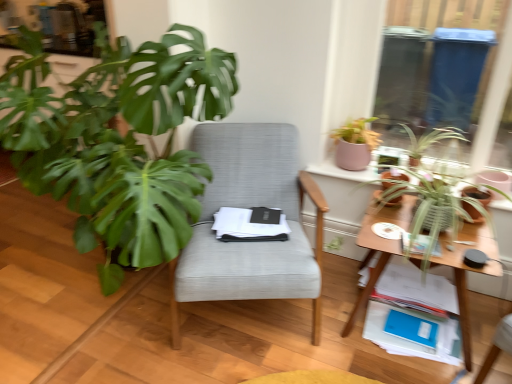
Locate an element on the screen. pink matte pot at upper right, positioned as the 2th houseplant in left-to-right order is located at coordinates (355, 144).

Measure the distance between leavesy green plant at right, the third houseplant viewed from the right, and camera.

They are 1.54 meters apart.

In order to face leavesy green plant at right, the third houseplant viewed from the right, should I rotate leftwards or rightwards?

To face it directly, rotate right by 20.957 degrees.

Locate an element on the screen. wooden table at right is located at coordinates (465, 272).

Locate an element on the screen. The height and width of the screenshot is (384, 512). green matte plant at left, the 1th houseplant in the left-to-right sequence is located at coordinates (117, 141).

Does green matte plant at left, the 1th houseplant in the left-to-right sequence, turn towards textured gray chair at center?

No, green matte plant at left, the 1th houseplant in the left-to-right sequence, is not oriented towards textured gray chair at center.

Can you tell me how much green matte plant at left, the fifth houseplant from the right, and textured gray chair at center differ in facing direction?

The angle between the facing direction of green matte plant at left, the fifth houseplant from the right, and the facing direction of textured gray chair at center is 26.8 degrees.

Is green matte plant at left, the fifth houseplant from the right, positioned behind textured gray chair at center?

No.

In the scene shown: Does green matte plant at left, the 1th houseplant in the left-to-right sequence, appear on the right side of textured gray chair at center?

No.

From a real-world perspective, is leavesy green plant at right, the third houseplant viewed from the right, physically located above or below green leafy plant at upper right, which is the 5th houseplant in left-to-right order?

Clearly, from a real-world perspective, leavesy green plant at right, the third houseplant viewed from the right, is below green leafy plant at upper right, which is the 5th houseplant in left-to-right order.

Could you tell me if leavesy green plant at right, the third houseplant viewed from the right, is facing green leafy plant at upper right, which is the 5th houseplant in left-to-right order?

No, leavesy green plant at right, the third houseplant viewed from the right, is not turned towards green leafy plant at upper right, which is the 5th houseplant in left-to-right order.

The height and width of the screenshot is (384, 512). In order to click on the 1st houseplant below the green leafy plant at upper right, which is the 5th houseplant in left-to-right order (from a real-world perspective) in this screenshot , I will do `click(430, 194)`.

Considering the sizes of leavesy green plant at right, the third houseplant viewed from the right, and green leafy plant at upper right, which is the 5th houseplant in left-to-right order, in the image, is leavesy green plant at right, the third houseplant viewed from the right, taller or shorter than green leafy plant at upper right, which is the 5th houseplant in left-to-right order,?

In the image, leavesy green plant at right, the third houseplant viewed from the right, appears to be taller than green leafy plant at upper right, which is the 5th houseplant in left-to-right order.

In the scene shown: Which is more to the right, green leafy plant at upper right, which is the 5th houseplant in left-to-right order, or wooden table at right?

Positioned to the right is green leafy plant at upper right, which is the 5th houseplant in left-to-right order.

Is green leafy plant at upper right, positioned as the first houseplant in right-to-left order, bigger or smaller than wooden table at right?

green leafy plant at upper right, positioned as the first houseplant in right-to-left order, is smaller than wooden table at right.

Is green leafy plant at upper right, which is the 5th houseplant in left-to-right order, completely or partially outside of wooden table at right?

green leafy plant at upper right, which is the 5th houseplant in left-to-right order, lies outside wooden table at right's area.

Considering their positions, is green leafy plant at upper right, which is the 5th houseplant in left-to-right order, located in front of or behind wooden table at right?

Clearly, green leafy plant at upper right, which is the 5th houseplant in left-to-right order, is behind wooden table at right.

Considering the relative sizes of wooden table at right and leavesy green plant at right, the third houseplant viewed from the right, in the image provided, is wooden table at right taller than leavesy green plant at right, the third houseplant viewed from the right,?

No.

Does point (381, 215) appear closer or farther from the camera than point (432, 221)?

Point (381, 215).

Based on the photo, considering the relative sizes of wooden table at right and leavesy green plant at right, the 3th houseplant in the left-to-right sequence, in the image provided, is wooden table at right bigger than leavesy green plant at right, the 3th houseplant in the left-to-right sequence,?

No.

From the image's perspective, is green matte plant pot at right, placed as the 1th flowerpot when sorted from right to left, under textured gray chair at center?

No.

Locate an element on the screen. This screenshot has height=384, width=512. the 2nd flowerpot counting from the right of the textured gray chair at center is located at coordinates (478, 195).

Is the depth of green matte plant pot at right, acting as the 2th flowerpot starting from the left, less than that of textured gray chair at center?

No, it is behind textured gray chair at center.

Consider the image. Considering the relative positions of green matte plant pot at right, acting as the 2th flowerpot starting from the left, and textured gray chair at center in the image provided, is green matte plant pot at right, acting as the 2th flowerpot starting from the left, to the right of textured gray chair at center from the viewer's perspective?

Indeed, green matte plant pot at right, acting as the 2th flowerpot starting from the left, is positioned on the right side of textured gray chair at center.

Considering the positions of objects textured gray chair at center and matte brown flowerpot at upper right, marked as the 2th flowerpot in a right-to-left arrangement, in the image provided, who is in front, textured gray chair at center or matte brown flowerpot at upper right, marked as the 2th flowerpot in a right-to-left arrangement,?

textured gray chair at center is closer to the camera.

From a real-world perspective, is textured gray chair at center physically below matte brown flowerpot at upper right, marked as the 2th flowerpot in a right-to-left arrangement?

Indeed, from a real-world perspective, textured gray chair at center is positioned beneath matte brown flowerpot at upper right, marked as the 2th flowerpot in a right-to-left arrangement.

Looking at this image, does textured gray chair at center have a smaller size compared to matte brown flowerpot at upper right, marked as the 2th flowerpot in a right-to-left arrangement?

Incorrect, textured gray chair at center is not smaller in size than matte brown flowerpot at upper right, marked as the 2th flowerpot in a right-to-left arrangement.

The height and width of the screenshot is (384, 512). I want to click on chair that is under the matte brown flowerpot at upper right, marked as the 2th flowerpot in a right-to-left arrangement (from a real-world perspective), so click(247, 207).

Could you tell me if pink matte pot at upper right, positioned as the 2th houseplant in left-to-right order, is facing green leafy plant at upper right, positioned as the first houseplant in right-to-left order?

No, pink matte pot at upper right, positioned as the 2th houseplant in left-to-right order, does not turn towards green leafy plant at upper right, positioned as the first houseplant in right-to-left order.

Is pink matte pot at upper right, positioned as the 2th houseplant in left-to-right order, outside of green leafy plant at upper right, which is the 5th houseplant in left-to-right order?

Indeed, pink matte pot at upper right, positioned as the 2th houseplant in left-to-right order, is completely outside green leafy plant at upper right, which is the 5th houseplant in left-to-right order.

Which object is closer to the camera, pink matte pot at upper right, the fourth houseplant viewed from the right, or green leafy plant at upper right, positioned as the first houseplant in right-to-left order?

green leafy plant at upper right, positioned as the first houseplant in right-to-left order, is in front.

From a real-world perspective, starting from the textured gray chair at center, which houseplant is the 5th one vertically above it? Please provide its 2D coordinates.

[(117, 141)]

You are a GUI agent. You are given a task and a screenshot of the screen. Output one action in this format:
    pyautogui.click(x=<x>, y=<y>)
    Task: Click on the 2nd houseplant in front of the green leafy plant at upper right, positioned as the first houseplant in right-to-left order, counting from the anchor's position
    
    Given the screenshot: What is the action you would take?
    pyautogui.click(x=430, y=194)

From the image, which object appears to be nearer to wooden table at right, pink matte pot at upper right, positioned as the 2th houseplant in left-to-right order, or leavesy green plant at right, the 3th houseplant in the left-to-right sequence?

leavesy green plant at right, the 3th houseplant in the left-to-right sequence, is positioned closer to the anchor wooden table at right.

Looking at the image, which one is located further to green leafy plant at upper right, the 2th houseplant from the right, leavesy green plant at right, the third houseplant viewed from the right, or matte brown flowerpot at upper right, positioned as the 1th flowerpot in left-to-right order?

Based on the image, matte brown flowerpot at upper right, positioned as the 1th flowerpot in left-to-right order, appears to be further to green leafy plant at upper right, the 2th houseplant from the right.

Considering their positions, is matte brown flowerpot at upper right, positioned as the 1th flowerpot in left-to-right order, positioned closer to green leafy plant at upper right, which is the 5th houseplant in left-to-right order, than leavesy green plant at right, the 3th houseplant in the left-to-right sequence?

leavesy green plant at right, the 3th houseplant in the left-to-right sequence, lies closer to green leafy plant at upper right, which is the 5th houseplant in left-to-right order, than the other object.

Which object lies nearer to the anchor point pink matte pot at upper right, positioned as the 2th houseplant in left-to-right order, green matte plant at left, the 1th houseplant in the left-to-right sequence, or textured gray chair at center?

textured gray chair at center is closer to pink matte pot at upper right, positioned as the 2th houseplant in left-to-right order.

From the image, which object appears to be nearer to wooden table at right, pink matte pot at upper right, the fourth houseplant viewed from the right, or matte brown flowerpot at upper right, positioned as the 1th flowerpot in left-to-right order?

matte brown flowerpot at upper right, positioned as the 1th flowerpot in left-to-right order, lies closer to wooden table at right than the other object.

Considering their positions, is green matte plant pot at right, acting as the 2th flowerpot starting from the left, positioned further to green leafy plant at upper right, the 2th houseplant from the right, than matte brown flowerpot at upper right, positioned as the 1th flowerpot in left-to-right order?

matte brown flowerpot at upper right, positioned as the 1th flowerpot in left-to-right order, is positioned further to the anchor green leafy plant at upper right, the 2th houseplant from the right.

From the image, which object appears to be farther from green matte plant pot at right, acting as the 2th flowerpot starting from the left, green matte plant at left, the fifth houseplant from the right, or green leafy plant at upper right, the 2th houseplant from the right?

green matte plant at left, the fifth houseplant from the right, is further to green matte plant pot at right, acting as the 2th flowerpot starting from the left.

Considering their positions, is green leafy plant at upper right, positioned as the first houseplant in right-to-left order, positioned closer to textured gray chair at center than leavesy green plant at right, the third houseplant viewed from the right?

Among the two, leavesy green plant at right, the third houseplant viewed from the right, is located nearer to textured gray chair at center.

Find the location of a particular element. This screenshot has height=384, width=512. table situated between green matte plant at left, the 1th houseplant in the left-to-right sequence, and green matte plant pot at right, placed as the 1th flowerpot when sorted from right to left, from left to right is located at coordinates (465, 272).

This screenshot has width=512, height=384. Find the location of `flowerpot located between green matte plant at left, the 1th houseplant in the left-to-right sequence, and wooden table at right in the left-right direction`. flowerpot located between green matte plant at left, the 1th houseplant in the left-to-right sequence, and wooden table at right in the left-right direction is located at coordinates (394, 176).

Find the location of a particular element. flowerpot between pink matte pot at upper right, positioned as the 2th houseplant in left-to-right order, and green leafy plant at upper right, the 2th houseplant from the right is located at coordinates (394, 176).

I want to click on flowerpot between pink matte pot at upper right, the fourth houseplant viewed from the right, and green matte plant pot at right, acting as the 2th flowerpot starting from the left, so click(394, 176).